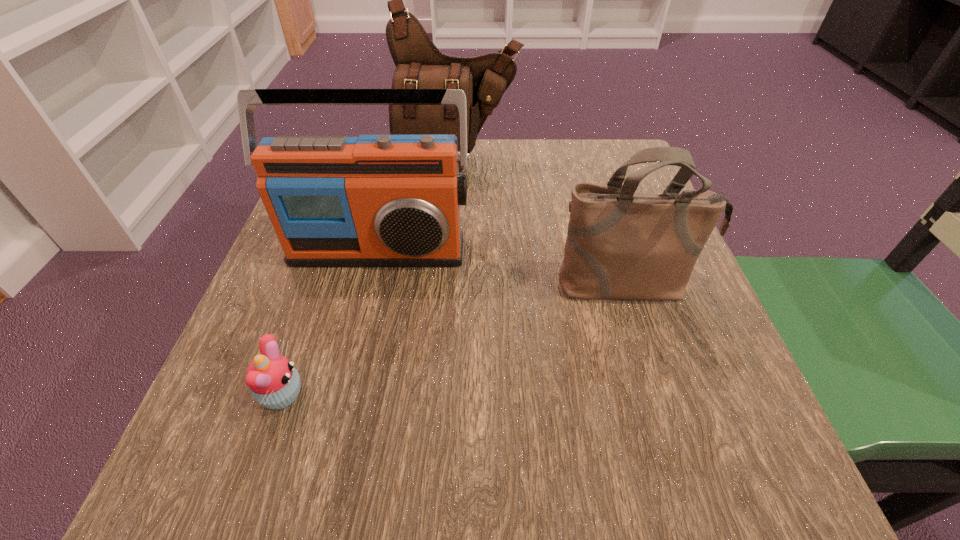
The image size is (960, 540). In order to click on empty location between the farthest object and the nearest object in this screenshot , I will do `click(370, 279)`.

Locate an element on the screen. vacant region between the right shoulder bag and the farthest object is located at coordinates (542, 224).

Where is `free spot between the nearest object and the shorter shoulder bag`? This screenshot has width=960, height=540. free spot between the nearest object and the shorter shoulder bag is located at coordinates (455, 340).

Locate an element on the screen. This screenshot has width=960, height=540. free space between the radio receiver and the shortest object is located at coordinates (330, 322).

The height and width of the screenshot is (540, 960). I want to click on free space between the right shoulder bag and the radio receiver, so click(503, 268).

The image size is (960, 540). What are the coordinates of `free spot between the left shoulder bag and the nearer shoulder bag` in the screenshot? It's located at (542, 224).

In order to click on vacant region between the left shoulder bag and the cupcake in this screenshot , I will do `click(370, 279)`.

At what (x,y) coordinates should I click in order to perform the action: click on object that can be found as the third closest to the left shoulder bag. Please return your answer as a coordinate pair (x, y). Looking at the image, I should click on (274, 382).

Select which object appears as the second closest to the radio receiver. Please provide its 2D coordinates. Your answer should be formatted as a tuple, i.e. [(x, y)], where the tuple contains the x and y coordinates of a point satisfying the conditions above.

[(419, 64)]

This screenshot has width=960, height=540. In order to click on vacant area in the image that satisfies the following two spatial constraints: 1. on the front-facing side of the right shoulder bag; 2. on the face of the shortest object in this screenshot , I will do `click(662, 395)`.